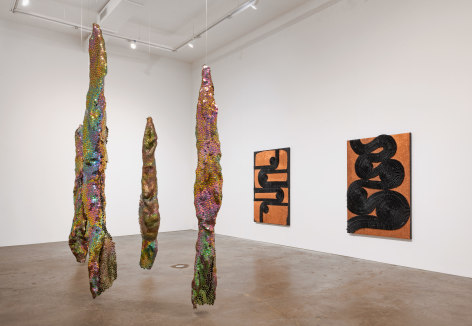
Locate an element on the screen. This screenshot has height=326, width=472. art is located at coordinates (98, 100).